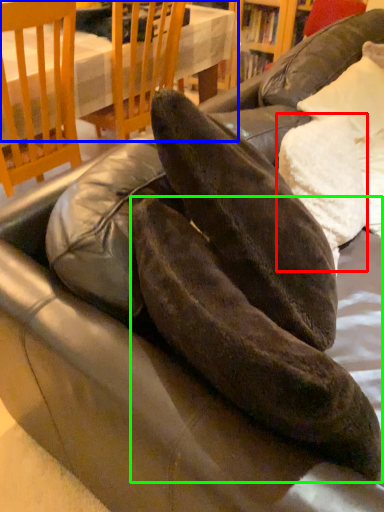
Question: Which is nearer to the pillow (highlighted by a red box)? table (highlighted by a blue box) or leather shoe (highlighted by a green box).

Choices:
 (A) table
 (B) leather shoe

Answer: (B)